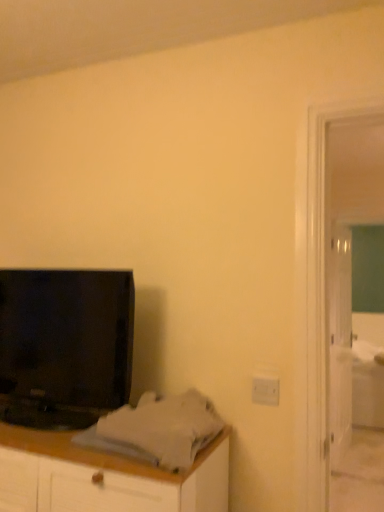
Where is `vacant space underneath white glossy door at right (from a real-world perspective)`? This screenshot has height=512, width=384. vacant space underneath white glossy door at right (from a real-world perspective) is located at coordinates (342, 457).